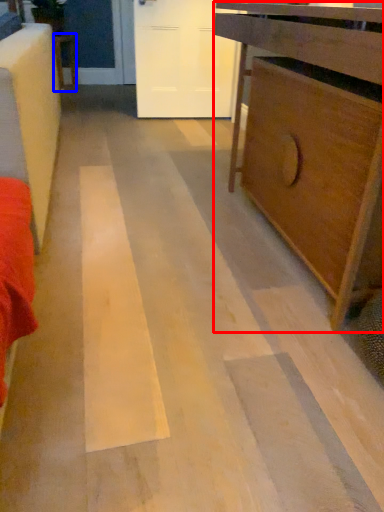
Question: Among these objects, which one is nearest to the camera, chest of drawers (highlighted by a red box) or furniture (highlighted by a blue box)?

Choices:
 (A) chest of drawers
 (B) furniture

Answer: (A)